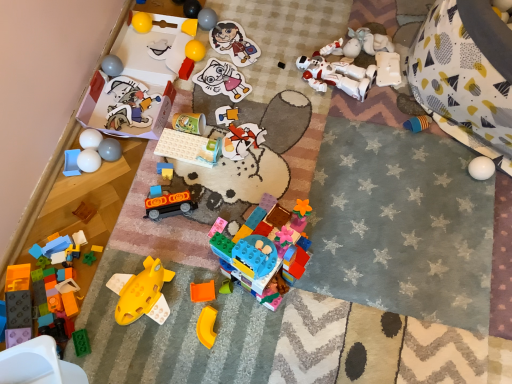
Find the location of a particular element. This screenshot has height=384, width=512. free space behind matte gray ball at upper left, acting as the 7th toy starting from the left is located at coordinates (123, 116).